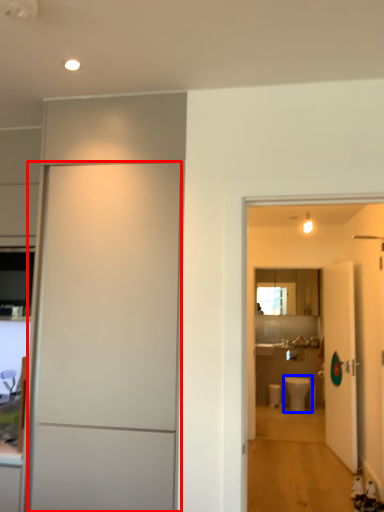
Question: Which of the following is the closest to the observer, door (highlighted by a red box) or toilet (highlighted by a blue box)?

Choices:
 (A) door
 (B) toilet

Answer: (A)